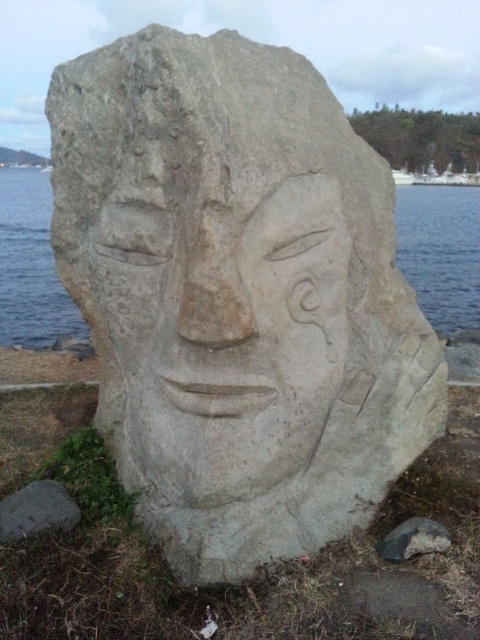
You are standing in front of the large stone sculpture of a human face. If you were to place a small marker exactly at the point with coordinates (224, 333), where would it be located relative to the white stone face at center?

The point with coordinates (224, 333) corresponds to the white stone face at center, so placing a marker there would place it directly on the face.

You are standing in front of the stone sculpture of a human face. You notice a point marked at coordinates (441,252). Based on the scene, what does this point most likely represent?

The point at (441,252) indicates clear water at lower left.